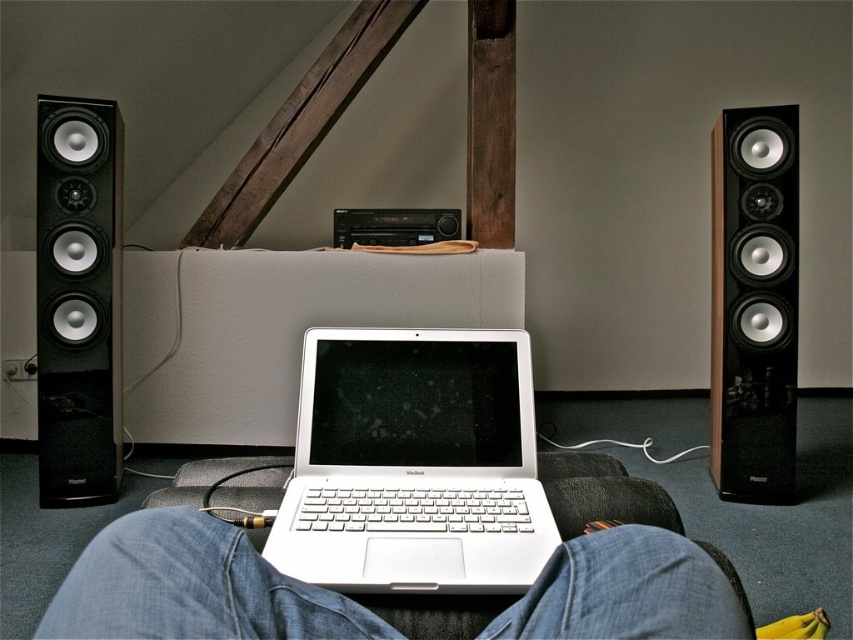
You are a delivery person trying to place a new speaker between the existing black glossy speaker at left and black glossy speaker at right. The new speaker requires a minimum of 1.5 meters of space between the two existing speakers to fit. Can you fit it based on the current spacing?

The distance between the black glossy speaker at left and black glossy speaker at right is 1.53 meters, which is just enough to accommodate the new speaker requiring a minimum of 1.5 meters of space.

You are an interior designer planning to place a new decorative item on the wall where the black glossy speaker at left is located. The wall has a rustic wooden beam diagonally placed. To ensure the item doesn not interfere with the beam, where should you place it relative to the speaker?

The black glossy speaker at left is positioned at point (78, 298). Since the rustic wooden beam is diagonally placed on the wall, placing the decorative item either above or below the beam, but not directly along its path, would prevent interference with the beam.

You are sitting on the couch and want to place your white metallic laptop at center on the coffee table which is 30 inches away from you. Can you reach it without moving from the couch?

The white metallic laptop at center is currently 25.50 inches away from the viewer, so yes, you can reach it as the distance is less than the 30 inches required to the coffee table.